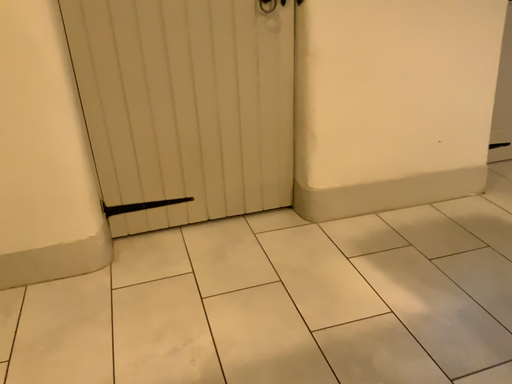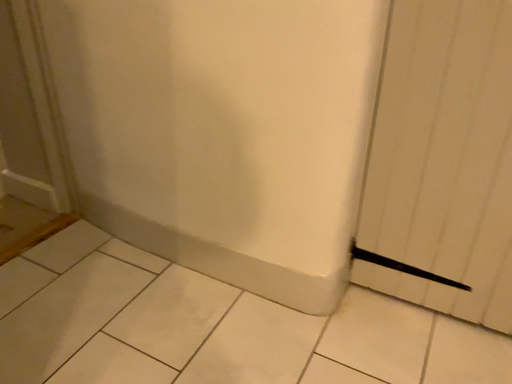
Question: How did the camera likely rotate when shooting the video?

Choices:
 (A) rotated upward
 (B) rotated downward

Answer: (A)